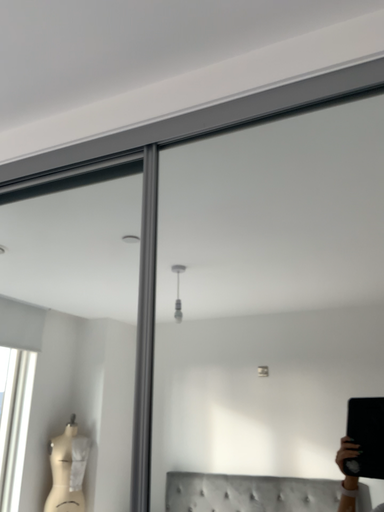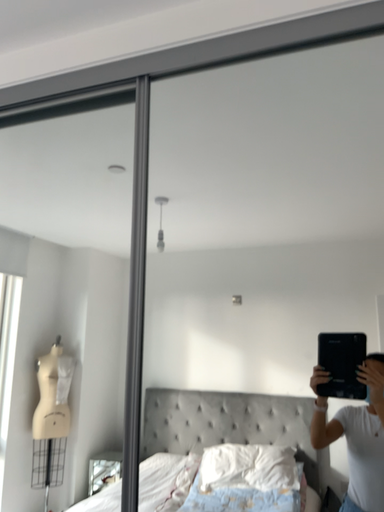
Question: Which way did the camera rotate in the video?

Choices:
 (A) rotated upward
 (B) rotated downward

Answer: (B)